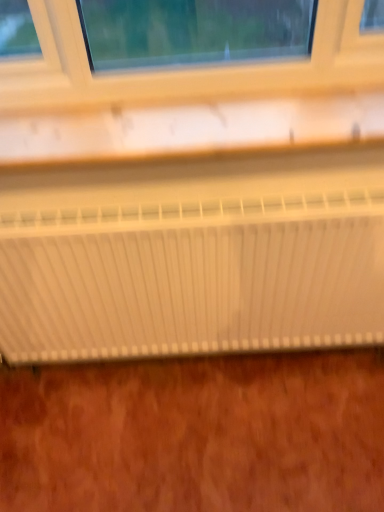
You are a GUI agent. You are given a task and a screenshot of the screen. Output one action in this format:
    pyautogui.click(x=<x>, y=<y>)
    Task: Click on the vacant space situated above white ribbed radiator at lower center (from a real-world perspective)
    Image resolution: width=384 pixels, height=512 pixels.
    Given the screenshot: What is the action you would take?
    pyautogui.click(x=204, y=186)